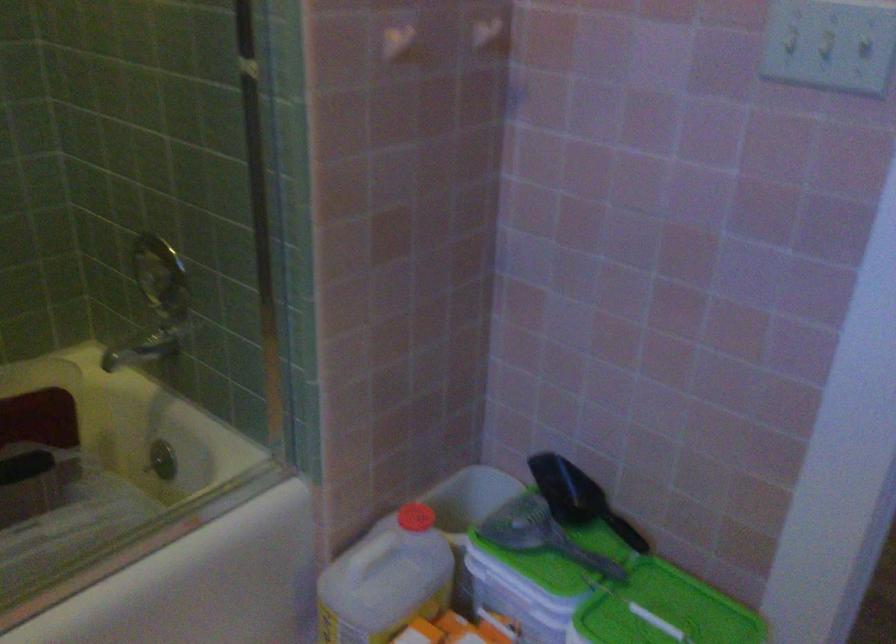
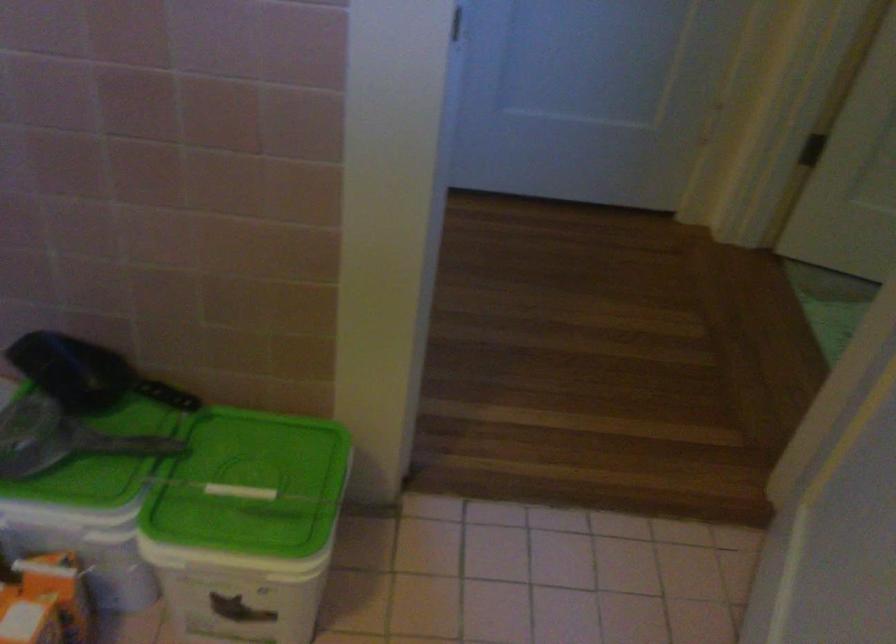
Where in the second image is the point corresponding to [547,542] from the first image?

(81, 448)